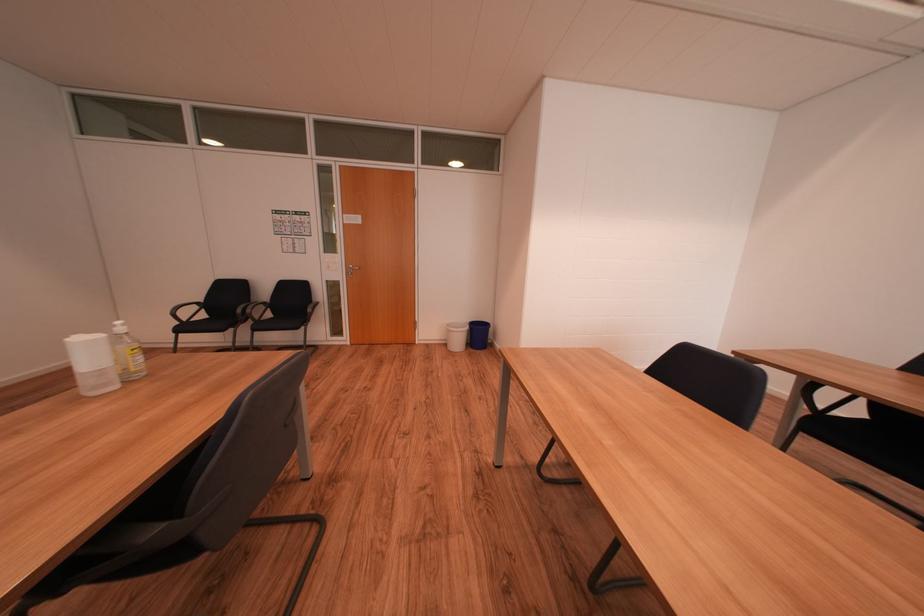
Where is `white dispenser pump`? The height and width of the screenshot is (616, 924). white dispenser pump is located at coordinates (118, 326).